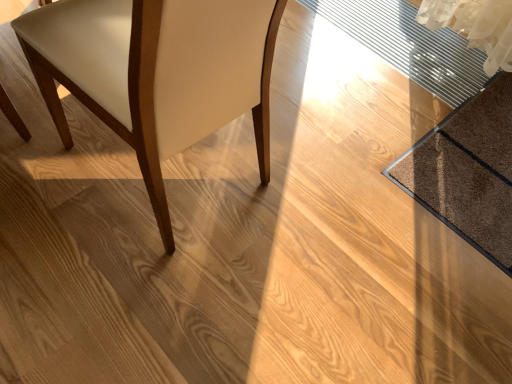
This screenshot has width=512, height=384. What are the coordinates of `matte white chair at center` in the screenshot? It's located at (157, 73).

What is the approximate height of matte white chair at center?

The height of matte white chair at center is 33.28 inches.

Measure the distance between matte white chair at center and camera.

The distance of matte white chair at center from camera is 23.64 inches.

The width and height of the screenshot is (512, 384). What do you see at coordinates (157, 73) in the screenshot?
I see `matte white chair at center` at bounding box center [157, 73].

Image resolution: width=512 pixels, height=384 pixels. Identify the location of matte white chair at center. (157, 73).